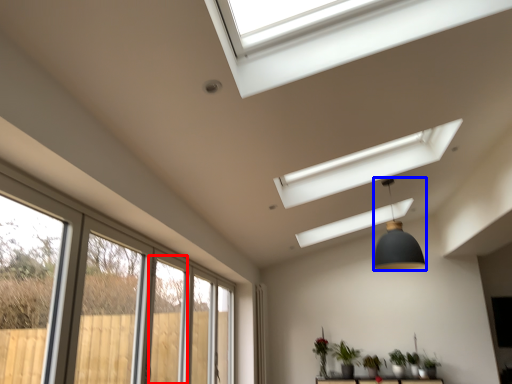
Question: Which point is closer to the camera, screen door (highlighted by a red box) or light fixture (highlighted by a blue box)?

Choices:
 (A) screen door
 (B) light fixture

Answer: (A)